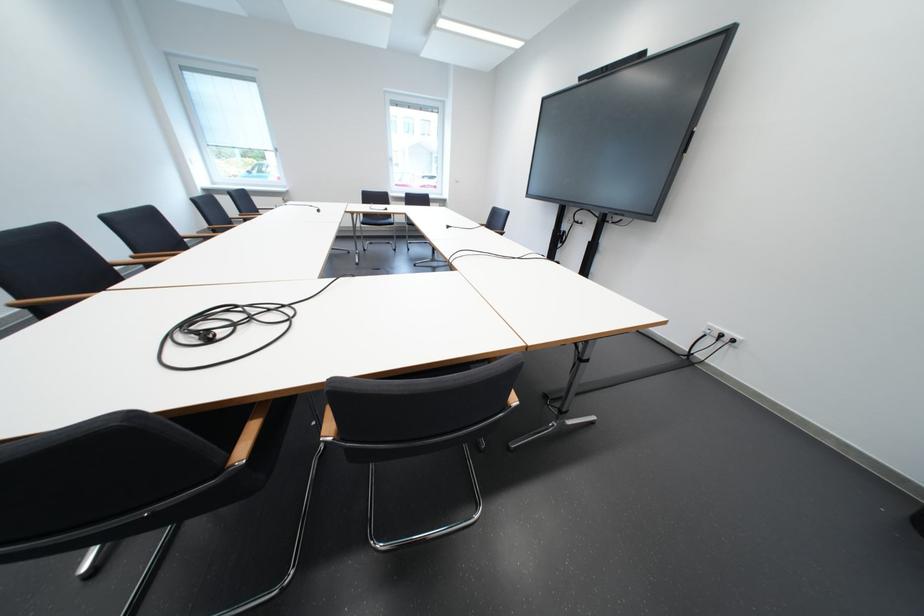
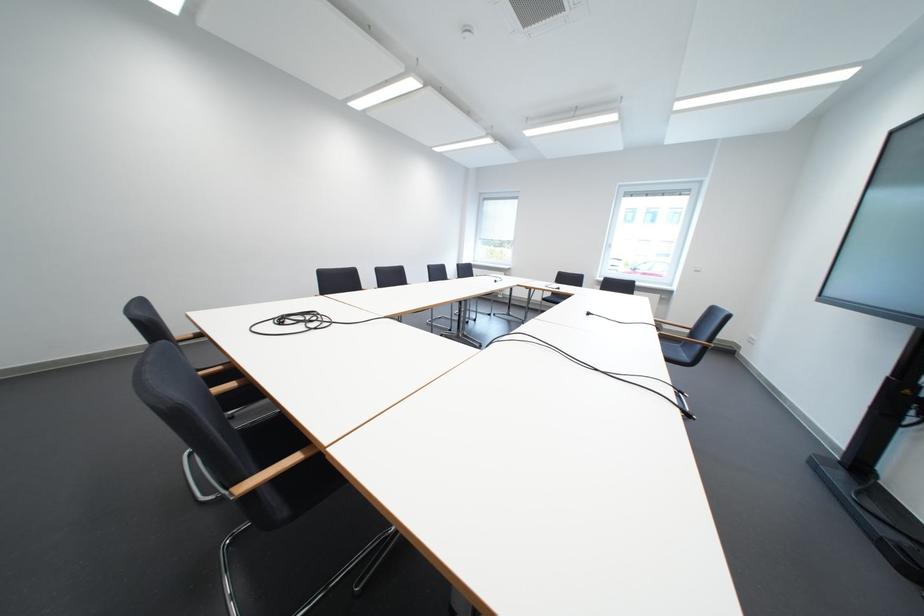
Find the pixel in the second image that matches point 460,229 in the first image.

(601, 315)